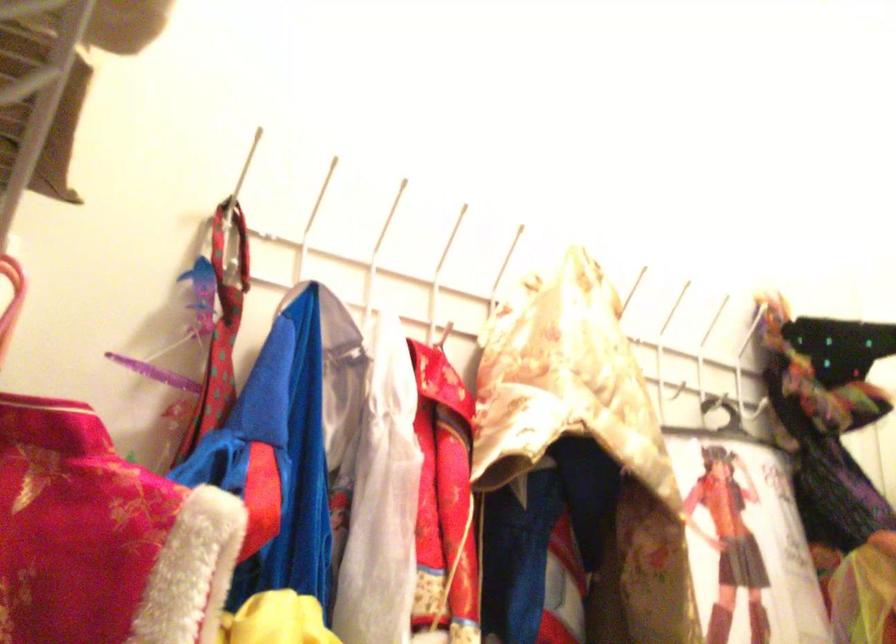
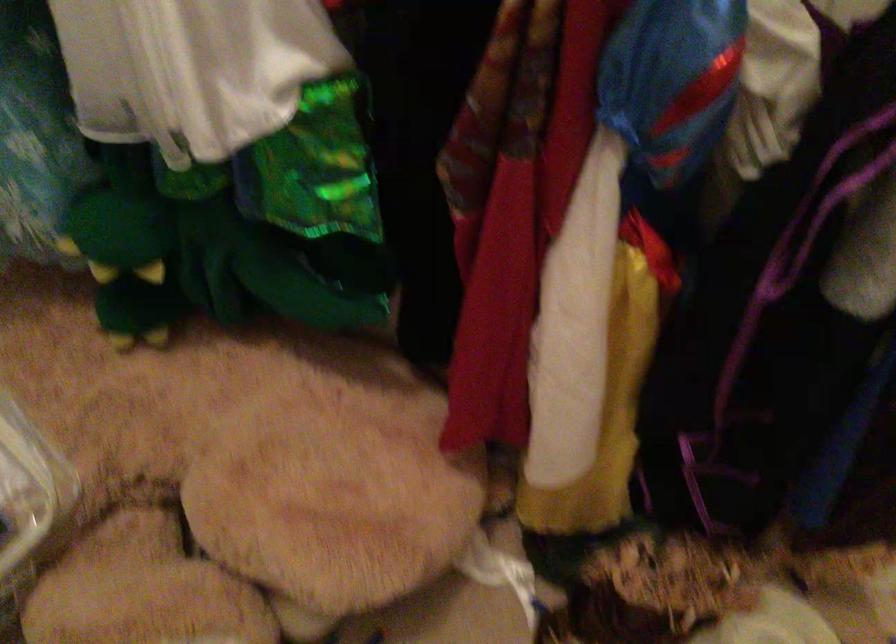
How did the camera likely rotate?

The camera's rotation is toward left-down.